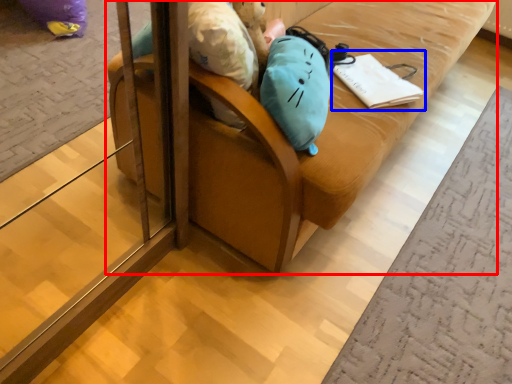
Question: Which of the following is the closest to the observer, furniture (highlighted by a red box) or notebook (highlighted by a blue box)?

Choices:
 (A) furniture
 (B) notebook

Answer: (A)